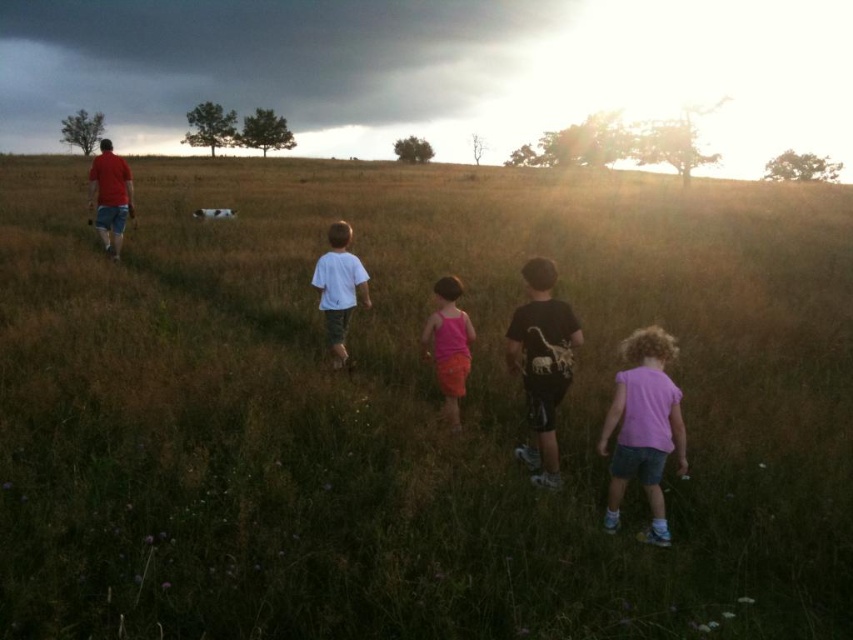
Question: Which object is positioned closest to the white cotton shirt at center?

Choices:
 (A) pink fabric dress at center
 (B) black matte t-shirt at center
 (C) pink fabric shirt at lower right

Answer: (A)

Question: Where is black matte t-shirt at center located in relation to pink fabric dress at center in the image?

Choices:
 (A) right
 (B) left

Answer: (A)

Question: Does pink fabric dress at center appear on the left side of white cotton shirt at center?

Choices:
 (A) no
 (B) yes

Answer: (A)

Question: Which of the following is the farthest from the observer?

Choices:
 (A) (548, 474)
 (B) (668, 419)

Answer: (A)

Question: Which point appears closest to the camera in this image?

Choices:
 (A) (537, 326)
 (B) (650, 403)
 (C) (447, 400)

Answer: (B)

Question: Does pink fabric dress at center have a greater width compared to white cotton shirt at center?

Choices:
 (A) no
 (B) yes

Answer: (A)